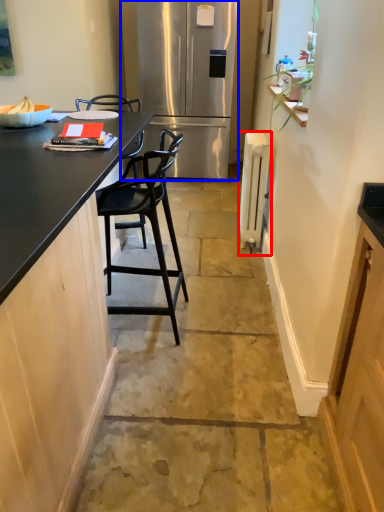
Question: Among these objects, which one is farthest to the camera, appliance (highlighted by a red box) or refrigerator (highlighted by a blue box)?

Choices:
 (A) appliance
 (B) refrigerator

Answer: (B)